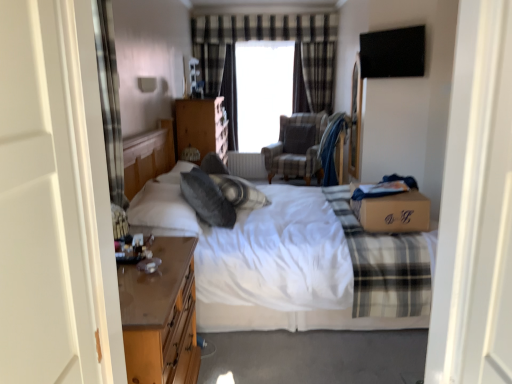
Question: Does plaid fabric at right have a greater height compared to gray soft pillow at center, the first pillow viewed from the front?

Choices:
 (A) yes
 (B) no

Answer: (A)

Question: Can you confirm if plaid fabric at right is smaller than gray soft pillow at center, the first pillow in the bottom-to-top sequence?

Choices:
 (A) yes
 (B) no

Answer: (B)

Question: Is there a large distance between plaid fabric at right and gray soft pillow at center, the first pillow in the bottom-to-top sequence?

Choices:
 (A) yes
 (B) no

Answer: (B)

Question: Is plaid fabric at right shorter than gray soft pillow at center, the first pillow viewed from the front?

Choices:
 (A) yes
 (B) no

Answer: (B)

Question: Considering the relative positions of plaid fabric at right and gray soft pillow at center, positioned as the second pillow in back-to-front order, in the image provided, is plaid fabric at right to the left of gray soft pillow at center, positioned as the second pillow in back-to-front order, from the viewer's perspective?

Choices:
 (A) no
 (B) yes

Answer: (A)

Question: From a real-world perspective, does plaid fabric at right sit lower than gray soft pillow at center, the 2th pillow viewed from the right?

Choices:
 (A) no
 (B) yes

Answer: (B)

Question: Can you confirm if white plastic radiator at center is smaller than wooden nightstand at lower left?

Choices:
 (A) no
 (B) yes

Answer: (B)

Question: Is wooden nightstand at lower left located within white plastic radiator at center?

Choices:
 (A) yes
 (B) no

Answer: (B)

Question: Does white plastic radiator at center have a greater height compared to wooden nightstand at lower left?

Choices:
 (A) no
 (B) yes

Answer: (A)

Question: Is white plastic radiator at center bigger than wooden nightstand at lower left?

Choices:
 (A) yes
 (B) no

Answer: (B)

Question: Considering the relative sizes of white plastic radiator at center and wooden nightstand at lower left in the image provided, is white plastic radiator at center thinner than wooden nightstand at lower left?

Choices:
 (A) no
 (B) yes

Answer: (B)

Question: Are white plastic radiator at center and wooden nightstand at lower left far apart?

Choices:
 (A) no
 (B) yes

Answer: (B)

Question: Does white cotton bed at center have a larger size compared to white plastic radiator at center?

Choices:
 (A) yes
 (B) no

Answer: (A)